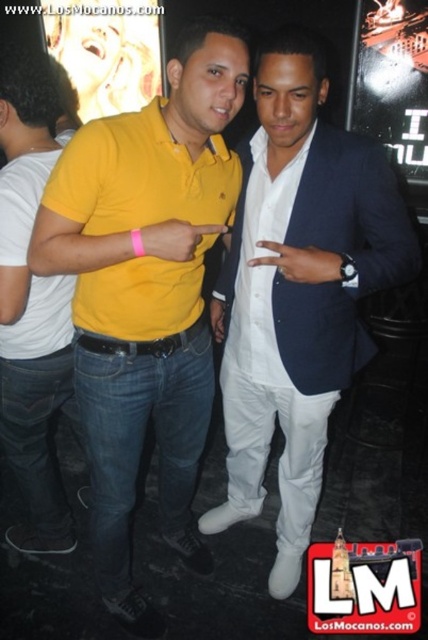
You are a photographer at the event and want to capture both the white satin suit at center and the matte yellow polo shirt at left in a single frame. Based on their positions and sizes, is it possible to include both in the shot without cropping either of them?

The white satin suit at center might be wider than matte yellow polo shirt at left, so it depends on the camera angle and distance. If positioned correctly, both could fit, but the photographer should ensure the wider suit doesn